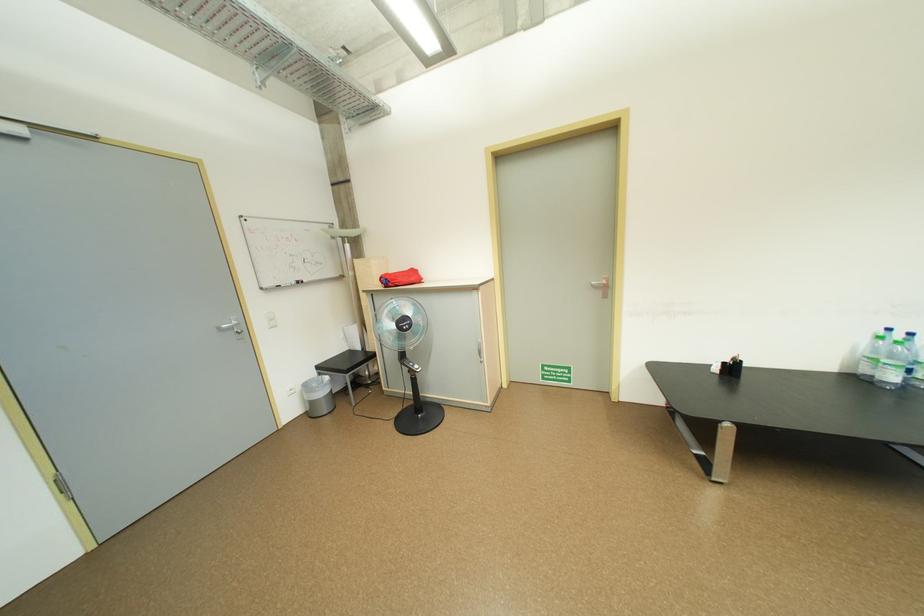
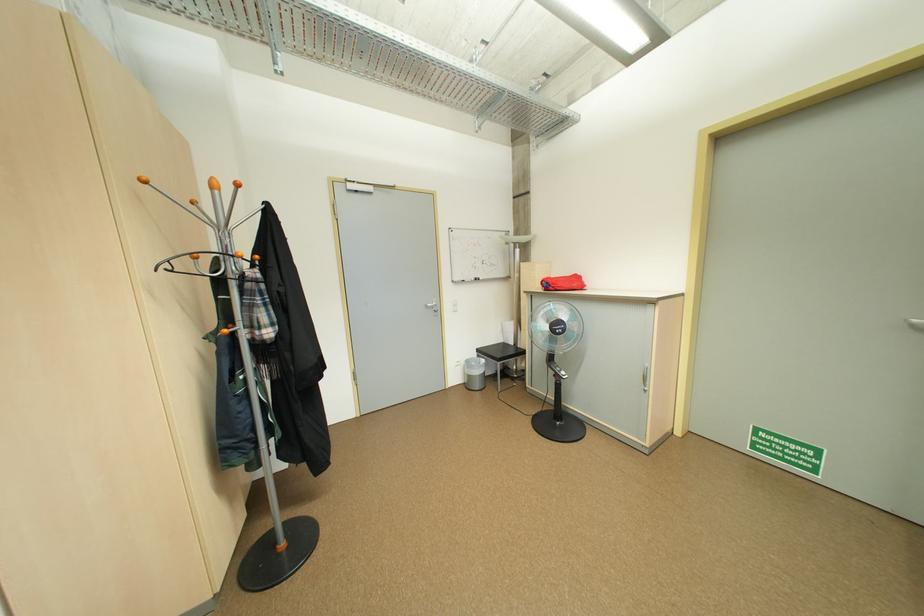
Where in the second image is the point corresponding to (x=388, y=286) from the first image?

(550, 290)